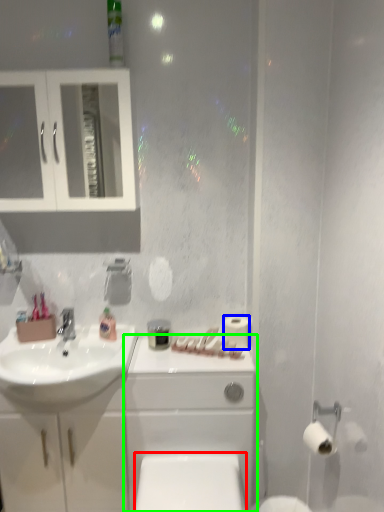
Question: Which object is the farthest from toilet bowl (highlighted by a red box)? Choose among these: toilet paper (highlighted by a blue box) or porcelain (highlighted by a green box).

Choices:
 (A) toilet paper
 (B) porcelain

Answer: (A)